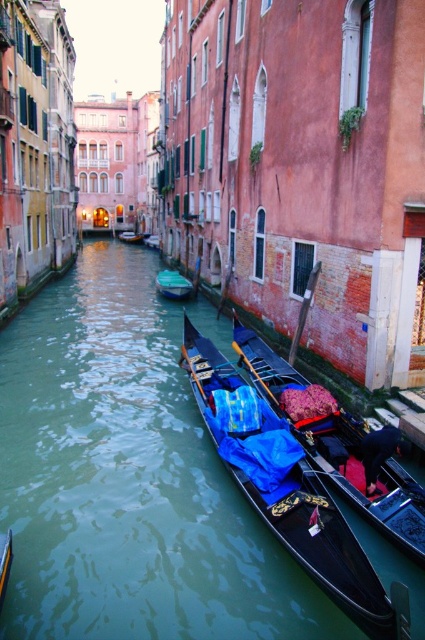
Question: Which point is closer to the camera?

Choices:
 (A) green plastic boat at center
 (B) black glossy canoe at center
 (C) green smooth water at center

Answer: (C)

Question: Which object is closer to the camera taking this photo?

Choices:
 (A) green plastic boat at center
 (B) green smooth water at center

Answer: (B)

Question: Does green smooth water at center have a larger size compared to green plastic boat at center?

Choices:
 (A) yes
 (B) no

Answer: (A)

Question: Does green smooth water at center appear on the left side of black glossy canoe at center?

Choices:
 (A) no
 (B) yes

Answer: (B)

Question: Estimate the real-world distances between objects in this image. Which object is closer to the black glossy canoe at center?

Choices:
 (A) green plastic boat at center
 (B) green smooth water at center

Answer: (B)

Question: Where is black glossy canoe at center located in relation to green plastic boat at center in the image?

Choices:
 (A) above
 (B) below

Answer: (B)